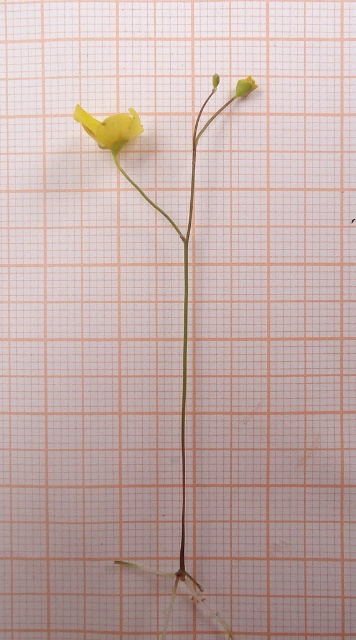
Question: Which point is farther to the camera?

Choices:
 (A) (181, 483)
 (B) (252, 81)

Answer: (A)

Question: Estimate the real-world distances between objects in this image. Which object is farther from the matte yellow flower at upper left?

Choices:
 (A) yellow matte flower at center
 (B) green matte flower at upper right

Answer: (A)

Question: Estimate the real-world distances between objects in this image. Which object is farther from the matte yellow flower at upper left?

Choices:
 (A) green matte flower at upper right
 (B) yellow matte flower at center

Answer: (B)

Question: Does yellow matte flower at center appear on the right side of matte yellow flower at upper left?

Choices:
 (A) yes
 (B) no

Answer: (A)

Question: Can you confirm if yellow matte flower at center is wider than green matte flower at upper right?

Choices:
 (A) no
 (B) yes

Answer: (B)

Question: Observing the image, what is the correct spatial positioning of yellow matte flower at center in reference to matte yellow flower at upper left?

Choices:
 (A) below
 (B) above

Answer: (A)